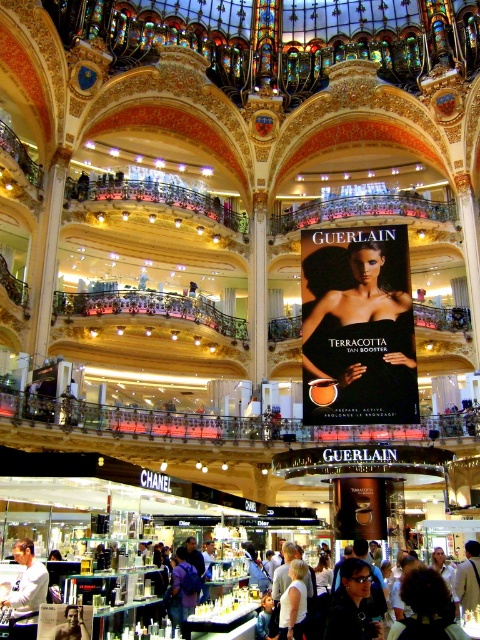
Question: Where is white cotton shirt at center located in relation to purple fabric backpack at center in the image?

Choices:
 (A) right
 (B) left

Answer: (B)

Question: Is matte black compact at center to the left of white cotton shirt at center from the viewer's perspective?

Choices:
 (A) no
 (B) yes

Answer: (A)

Question: Does purple fabric backpack at center have a greater width compared to smooth skin torso at center?

Choices:
 (A) yes
 (B) no

Answer: (A)

Question: Which object is farther from the camera taking this photo?

Choices:
 (A) white cotton shirt at center
 (B) matte black compact at center

Answer: (B)

Question: Which of these objects is positioned closest to the matte black compact at center?

Choices:
 (A) dark sunglasses at center
 (B) purple fabric backpack at center
 (C) white cotton shirt at center

Answer: (B)

Question: Which of these objects is positioned farthest from the white cotton shirt at center?

Choices:
 (A) dark sunglasses at center
 (B) purple fabric backpack at center
 (C) matte black compact at center
 (D) smooth skin torso at center

Answer: (C)